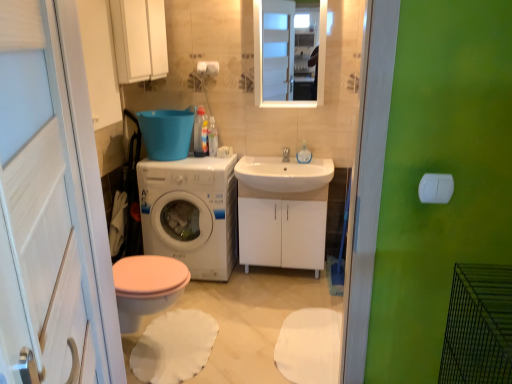
Question: From a real-world perspective, is white glossy cabinet at center on white matte toilet paper at center?

Choices:
 (A) no
 (B) yes

Answer: (A)

Question: Could you tell me if white glossy cabinet at center is facing white matte toilet paper at center?

Choices:
 (A) yes
 (B) no

Answer: (B)

Question: Does white glossy cabinet at center have a larger size compared to white matte toilet paper at center?

Choices:
 (A) no
 (B) yes

Answer: (B)

Question: Does white glossy cabinet at center appear on the left side of white matte toilet paper at center?

Choices:
 (A) yes
 (B) no

Answer: (B)

Question: Can you confirm if white glossy cabinet at center is positioned to the right of white matte toilet paper at center?

Choices:
 (A) no
 (B) yes

Answer: (B)

Question: Is point (311, 216) closer or farther from the camera than point (287, 152)?

Choices:
 (A) closer
 (B) farther

Answer: (A)

Question: In terms of width, does white glossy cabinet at center look wider or thinner when compared to white glossy sink at center?

Choices:
 (A) wide
 (B) thin

Answer: (A)

Question: Would you say white glossy cabinet at center is to the left or to the right of white glossy sink at center in the picture?

Choices:
 (A) right
 (B) left

Answer: (B)

Question: Do you think white glossy cabinet at center is within white glossy sink at center, or outside of it?

Choices:
 (A) outside
 (B) inside

Answer: (A)

Question: Is white glossy cabinet at center in front of or behind white glossy cabinet at upper center in the image?

Choices:
 (A) front
 (B) behind

Answer: (B)

Question: Is white glossy cabinet at center inside the boundaries of white glossy cabinet at upper center, or outside?

Choices:
 (A) inside
 (B) outside

Answer: (B)

Question: From the image's perspective, is white glossy cabinet at center above or below white glossy cabinet at upper center?

Choices:
 (A) above
 (B) below

Answer: (B)

Question: Considering the positions of point (274, 200) and point (259, 79), is point (274, 200) closer or farther from the camera than point (259, 79)?

Choices:
 (A) farther
 (B) closer

Answer: (B)

Question: Would you say white glossy cabinet at center is inside or outside white matte toilet paper at center?

Choices:
 (A) outside
 (B) inside

Answer: (A)

Question: From the image's perspective, is white glossy cabinet at center positioned above or below white matte toilet paper at center?

Choices:
 (A) above
 (B) below

Answer: (B)